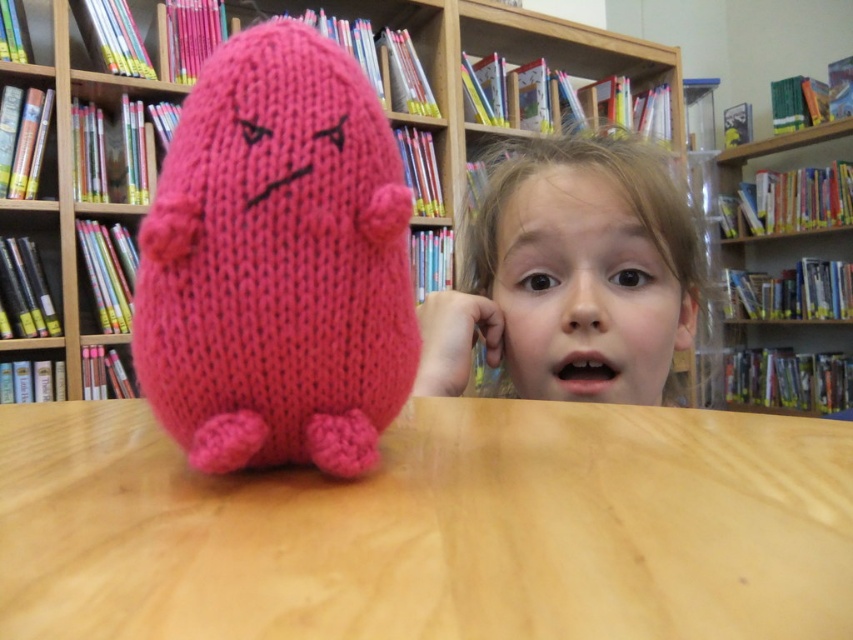
Question: Estimate the real-world distances between objects in this image. Which object is closer to the wooden table at center?

Choices:
 (A) wooden bookshelf at upper right
 (B) matte pink plushie at center

Answer: (B)

Question: Is wooden bookcase at upper center smaller than wooden bookshelf at upper right?

Choices:
 (A) yes
 (B) no

Answer: (B)

Question: Which point is closer to the camera?

Choices:
 (A) wooden bookshelf at upper right
 (B) wooden table at center
 (C) knitted pink plush at center
 (D) wooden bookcase at upper center

Answer: (B)

Question: Estimate the real-world distances between objects in this image. Which object is farther from the knitted pink plush at center?

Choices:
 (A) wooden bookshelf at upper right
 (B) matte pink plushie at center
 (C) wooden bookcase at upper center
 (D) wooden table at center

Answer: (A)

Question: Can you confirm if wooden table at center is thinner than knitted pink plush at center?

Choices:
 (A) yes
 (B) no

Answer: (B)

Question: Where is wooden table at center located in relation to wooden bookshelf at upper right in the image?

Choices:
 (A) below
 (B) above

Answer: (A)